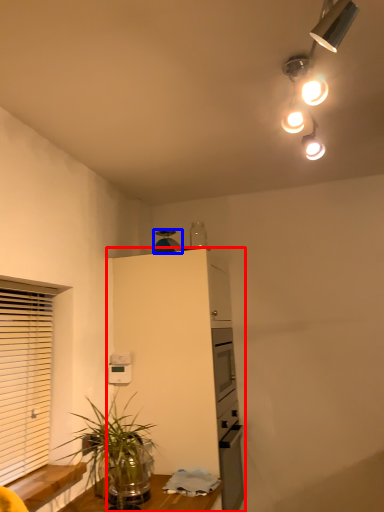
Question: Which point is closer to the camera, cabinetry (highlighted by a red box) or appliance (highlighted by a blue box)?

Choices:
 (A) cabinetry
 (B) appliance

Answer: (A)